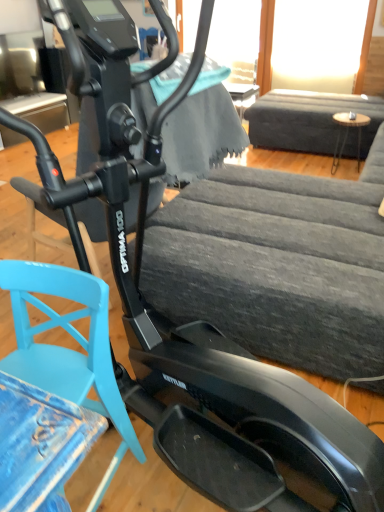
Question: Is light blue plastic swivel chair at lower left far from wooden round table at right?

Choices:
 (A) yes
 (B) no

Answer: (A)

Question: Considering the relative sizes of light blue plastic swivel chair at lower left and wooden round table at right in the image provided, is light blue plastic swivel chair at lower left wider than wooden round table at right?

Choices:
 (A) yes
 (B) no

Answer: (A)

Question: From the image's perspective, is light blue plastic swivel chair at lower left below wooden round table at right?

Choices:
 (A) no
 (B) yes

Answer: (B)

Question: Does light blue plastic swivel chair at lower left appear on the left side of wooden round table at right?

Choices:
 (A) no
 (B) yes

Answer: (B)

Question: Is light blue plastic swivel chair at lower left aimed at wooden round table at right?

Choices:
 (A) yes
 (B) no

Answer: (B)

Question: Looking at their shapes, would you say dark gray fabric couch at upper right is wider or thinner than wooden round table at right?

Choices:
 (A) wide
 (B) thin

Answer: (A)

Question: From a real-world perspective, relative to wooden round table at right, is dark gray fabric couch at upper right vertically above or below?

Choices:
 (A) below
 (B) above

Answer: (B)

Question: Based on their sizes in the image, would you say dark gray fabric couch at upper right is bigger or smaller than wooden round table at right?

Choices:
 (A) big
 (B) small

Answer: (A)

Question: In the image, is dark gray fabric couch at upper right on the left side or the right side of wooden round table at right?

Choices:
 (A) right
 (B) left

Answer: (A)

Question: Visually, is light blue plastic swivel chair at lower left positioned to the left or to the right of wooden round table at right?

Choices:
 (A) left
 (B) right

Answer: (A)

Question: Is light blue plastic swivel chair at lower left bigger or smaller than wooden round table at right?

Choices:
 (A) big
 (B) small

Answer: (A)

Question: Relative to wooden round table at right, is light blue plastic swivel chair at lower left in front or behind?

Choices:
 (A) behind
 (B) front

Answer: (B)

Question: From a real-world perspective, is light blue plastic swivel chair at lower left physically located above or below wooden round table at right?

Choices:
 (A) above
 (B) below

Answer: (A)

Question: From a real-world perspective, relative to dark gray fabric couch at upper right, is light blue plastic swivel chair at lower left vertically above or below?

Choices:
 (A) below
 (B) above

Answer: (A)

Question: Is point (140, 454) closer or farther from the camera than point (307, 133)?

Choices:
 (A) farther
 (B) closer

Answer: (B)